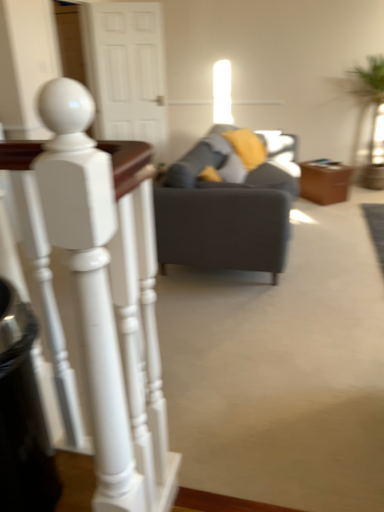
Image resolution: width=384 pixels, height=512 pixels. Find the location of `space that is in front of matte gray couch at center`. space that is in front of matte gray couch at center is located at coordinates (279, 333).